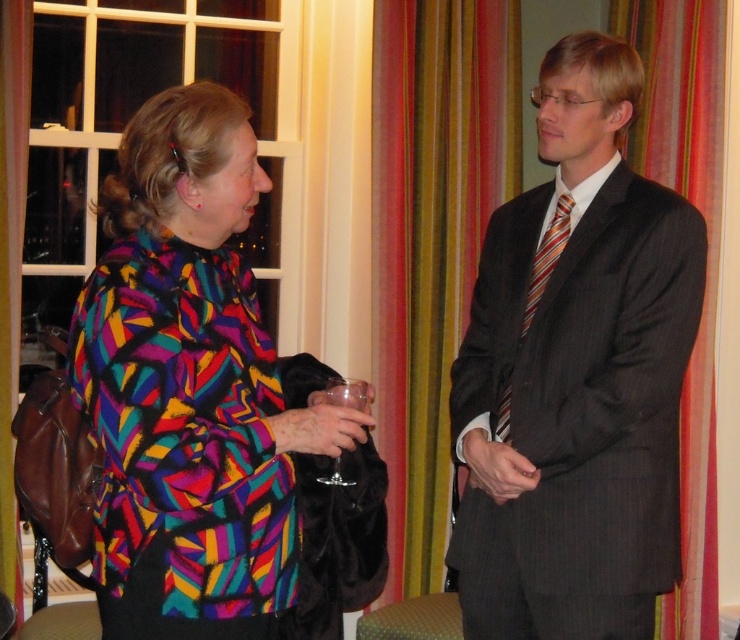
This screenshot has height=640, width=740. Describe the element at coordinates (189, 387) in the screenshot. I see `multicolored fabric coat at left` at that location.

Which is behind, point (169, 348) or point (363, 385)?

The point (363, 385) is behind.

In order to click on multicolored fabric coat at left in this screenshot , I will do coord(189,387).

This screenshot has width=740, height=640. In order to click on multicolored fabric coat at left in this screenshot , I will do `click(189, 387)`.

Which is below, striped fabric curtain at right or striped silk tie at center?

striped silk tie at center is below.

Is striped fabric curtain at right thinner than striped silk tie at center?

No, striped fabric curtain at right is not thinner than striped silk tie at center.

Is point (465, 225) positioned before point (531, 296)?

No, (465, 225) is behind (531, 296).

Locate an element on the screen. The height and width of the screenshot is (640, 740). striped fabric curtain at right is located at coordinates (431, 237).

Which is behind, point (562, 456) or point (528, 308)?

Point (528, 308)

The height and width of the screenshot is (640, 740). I want to click on dark gray pinstripe suit at right, so click(576, 374).